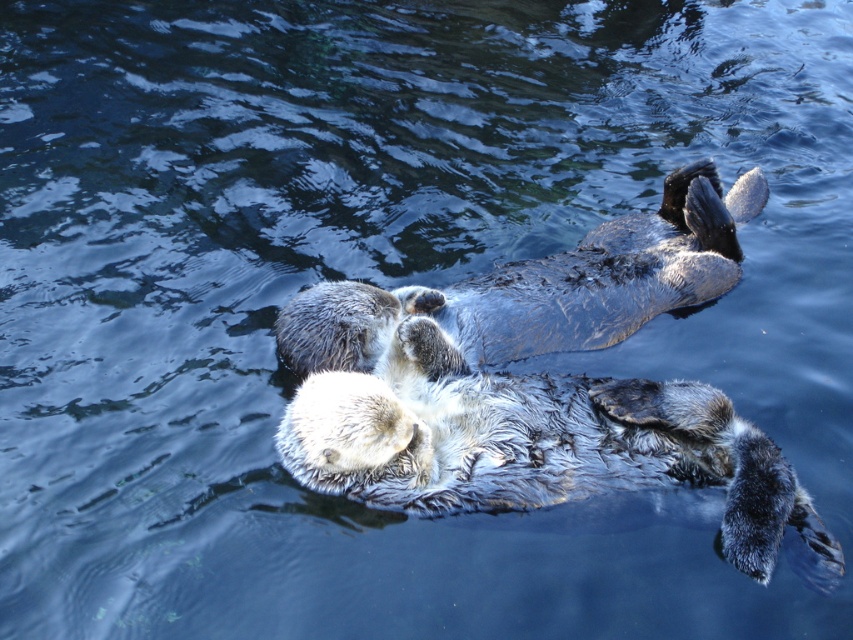
Who is positioned more to the right, soft brown fur otter at center or gray-furred otter at center?

Positioned to the right is soft brown fur otter at center.

Can you confirm if soft brown fur otter at center is taller than gray-furred otter at center?

Correct, soft brown fur otter at center is much taller as gray-furred otter at center.

Is point (334, 454) in front of point (440, 298)?

That is True.

The height and width of the screenshot is (640, 853). I want to click on soft brown fur otter at center, so click(x=515, y=429).